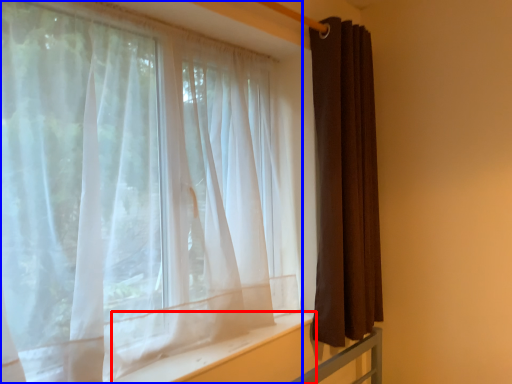
Question: Which of the following is the farthest to the observer, window sill (highlighted by a red box) or curtain (highlighted by a blue box)?

Choices:
 (A) window sill
 (B) curtain

Answer: (A)